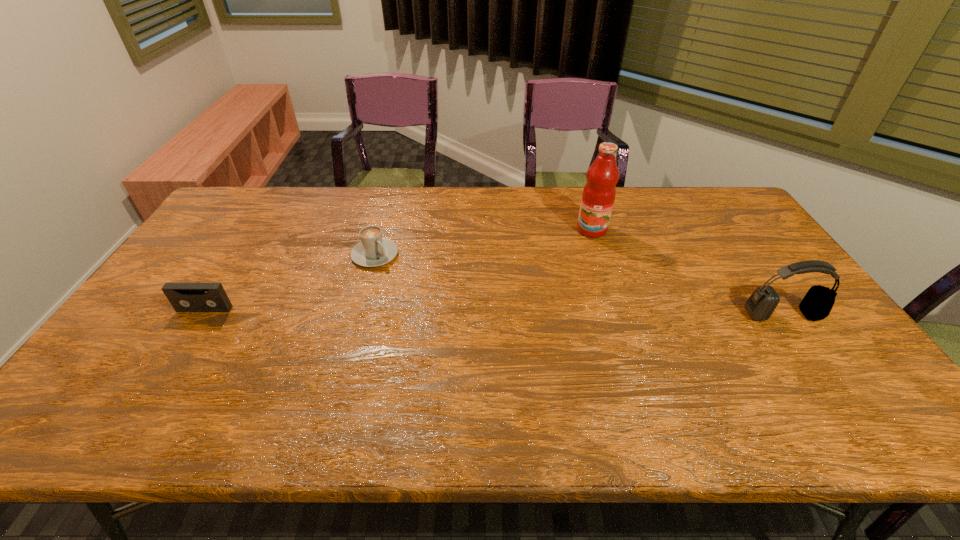
Identify the location of vacant region located 0.090m on the front label of the third object from left to right. The width and height of the screenshot is (960, 540). (587, 255).

Locate an element on the screen. This screenshot has height=540, width=960. vacant area situated 0.280m on the front label of the third object from left to right is located at coordinates pyautogui.click(x=578, y=296).

The image size is (960, 540). In order to click on vacant space positioned to the right of the second farthest object in this screenshot , I will do `click(441, 315)`.

You are a GUI agent. You are given a task and a screenshot of the screen. Output one action in this format:
    pyautogui.click(x=<x>, y=<y>)
    Task: Click on the free space located 0.250m to the right of the second farthest object
    
    Given the screenshot: What is the action you would take?
    pyautogui.click(x=436, y=312)

The height and width of the screenshot is (540, 960). I want to click on free space located to the right of the second farthest object, so click(x=421, y=298).

At what (x,y) coordinates should I click in order to perform the action: click on object that is at the far edge. Please return your answer as a coordinate pair (x, y). Looking at the image, I should click on (598, 196).

This screenshot has width=960, height=540. What are the coordinates of `object at the left edge` in the screenshot? It's located at (184, 297).

Locate an element on the screen. Image resolution: width=960 pixels, height=540 pixels. object located at the right edge is located at coordinates (816, 305).

In the image, there is a desktop. In order to click on free space at the far edge in this screenshot , I will do `click(545, 192)`.

Locate an element on the screen. The image size is (960, 540). free space at the near edge of the desktop is located at coordinates (311, 365).